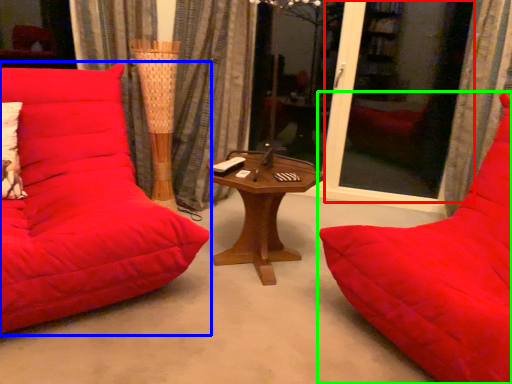
Question: Which is nearer to the screen door (highlighted by a red box)? studio couch (highlighted by a blue box) or studio couch (highlighted by a green box).

Choices:
 (A) studio couch
 (B) studio couch

Answer: (B)